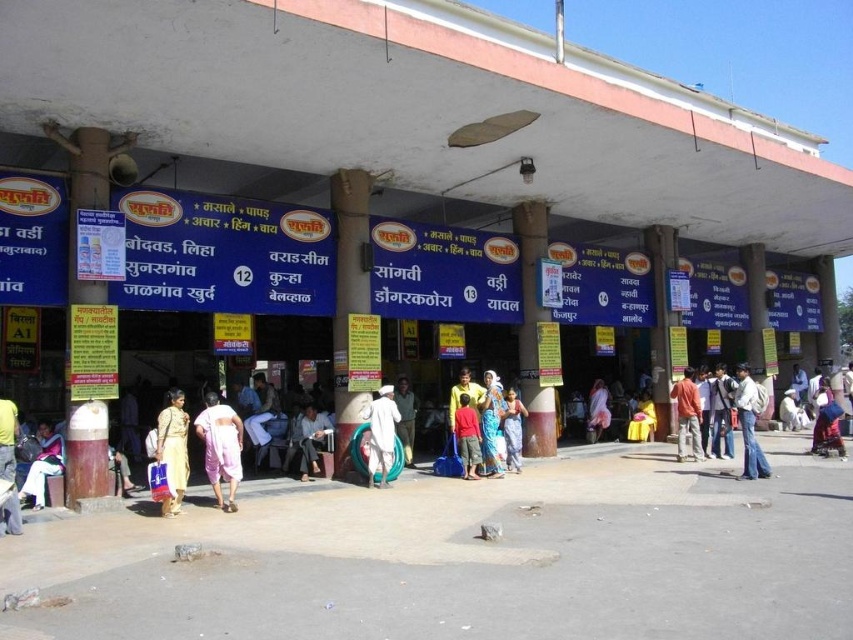
Question: Which of the following is the closest to the observer?

Choices:
 (A) dark blue jeans at center
 (B) light brown fabric dress at lower left
 (C) red cotton shirt at center
 (D) golden fabric dress at center

Answer: (B)

Question: From the image, what is the correct spatial relationship of printed cotton saree at center in relation to pink fabric at center?

Choices:
 (A) right
 (B) left

Answer: (B)

Question: Which point is farther from the camera taking this photo?

Choices:
 (A) (595, 392)
 (B) (645, 420)

Answer: (A)

Question: Does white cotton turban at center come in front of golden fabric dress at center?

Choices:
 (A) yes
 (B) no

Answer: (A)

Question: Which of the following is the closest to the observer?

Choices:
 (A) (500, 428)
 (B) (718, 374)
 (C) (741, 433)
 (D) (177, 448)

Answer: (D)

Question: Is light brown fabric bag at lower left positioned in front of blue fabric bag at center?

Choices:
 (A) no
 (B) yes

Answer: (B)